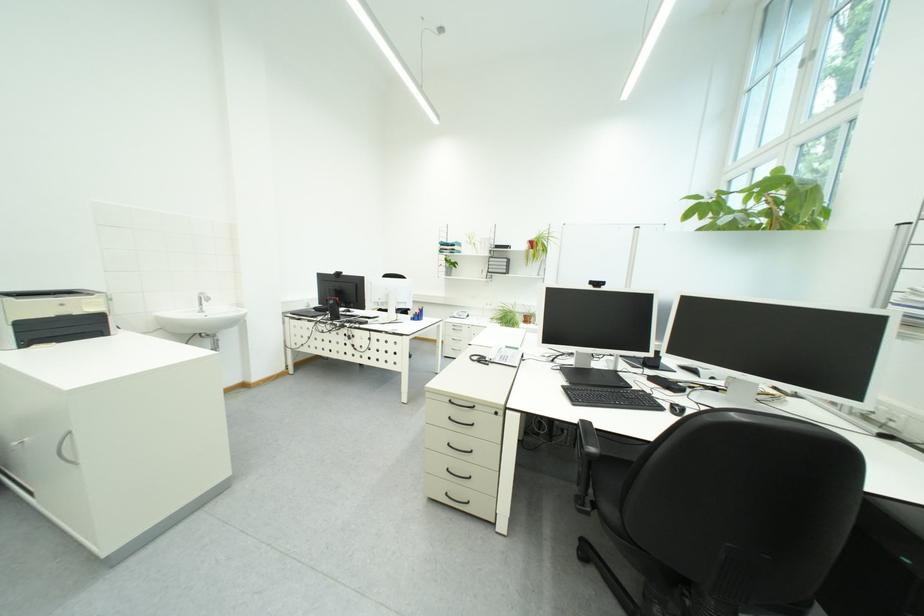
Where would you rest the black chair armrest? Please return your answer as a coordinate pair (x, y).

(588, 440)